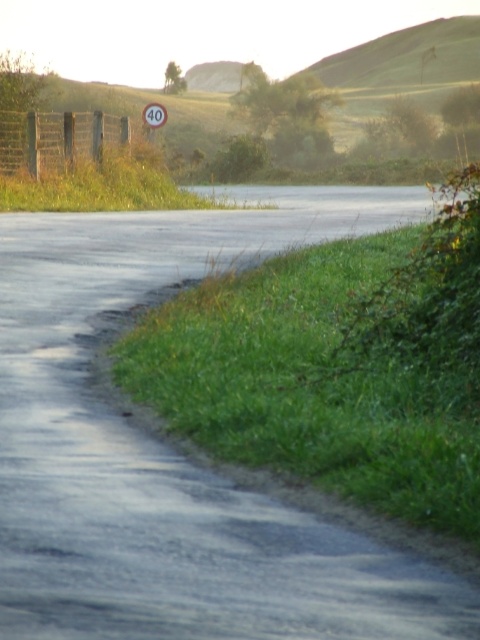
Which of these two, green grassy hill at upper center or white plastic sign at upper center, stands shorter?

With less height is white plastic sign at upper center.

Does green grassy hill at upper center have a smaller size compared to white plastic sign at upper center?

Incorrect, green grassy hill at upper center is not smaller in size than white plastic sign at upper center.

Is point (356, 51) behind point (149, 108)?

Yes, it is behind point (149, 108).

At what (x,y) coordinates should I click in order to perform the action: click on green grassy hill at upper center. Please return your answer as a coordinate pair (x, y). Looking at the image, I should click on (407, 56).

Is smooth asphalt road at center to the right of green grassy hill at upper center from the viewer's perspective?

In fact, smooth asphalt road at center is to the left of green grassy hill at upper center.

Can you confirm if smooth asphalt road at center is wider than green grassy hill at upper center?

No.

Image resolution: width=480 pixels, height=640 pixels. I want to click on smooth asphalt road at center, so click(x=172, y=449).

This screenshot has height=640, width=480. I want to click on smooth asphalt road at center, so click(172, 449).

Does smooth asphalt road at center have a larger size compared to white plastic sign at upper center?

Yes.

Locate an element on the screen. smooth asphalt road at center is located at coordinates (172, 449).